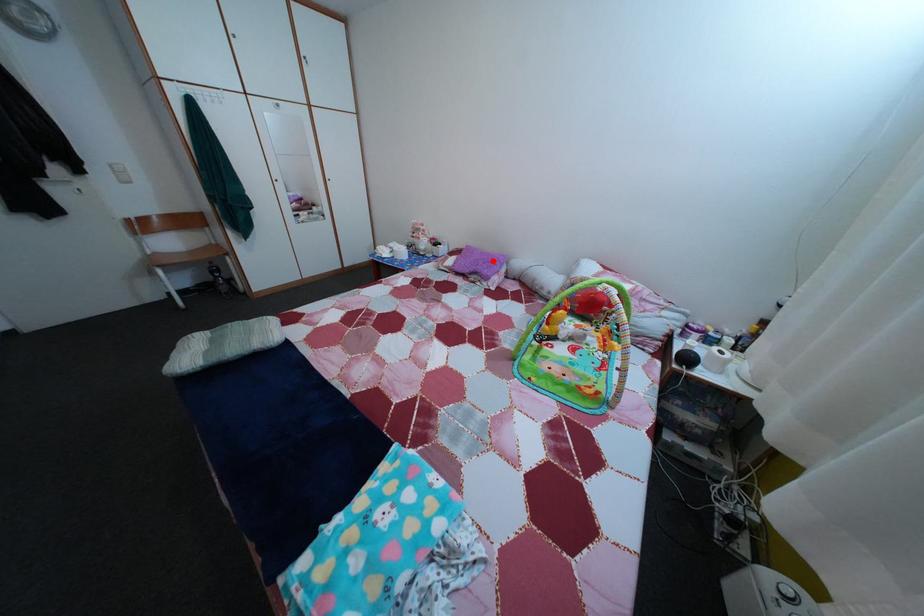
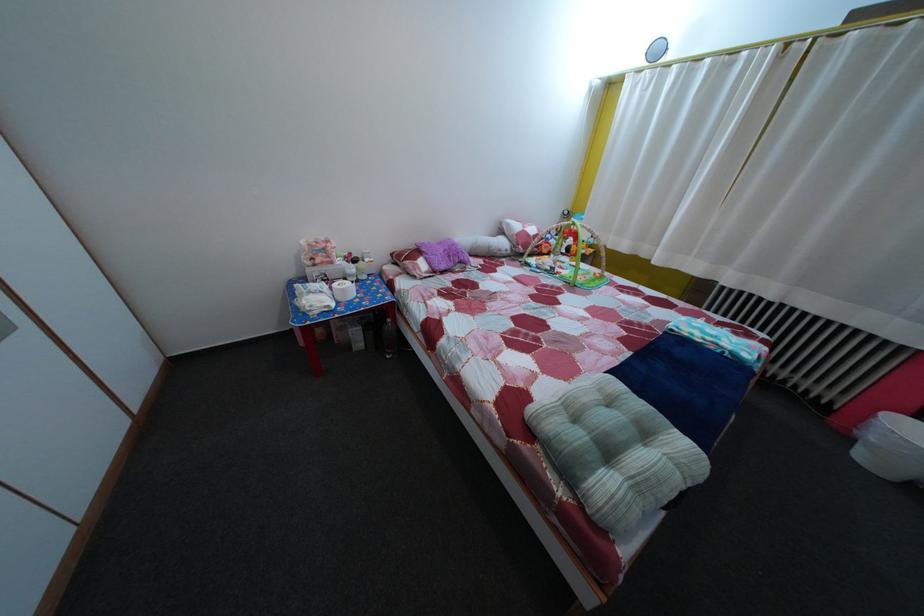
The point at the highlighted location is marked in the first image. Where is the corresponding point in the second image?

(450, 252)